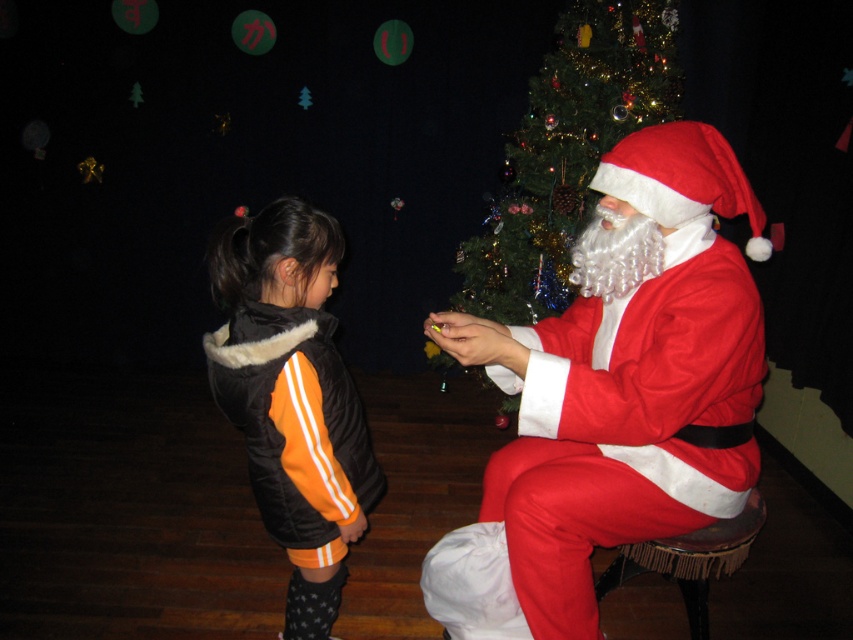
Is point (572, 184) farther from viewer compared to point (711, 548)?

Yes, it is.

You are a GUI agent. You are given a task and a screenshot of the screen. Output one action in this format:
    pyautogui.click(x=<x>, y=<y>)
    Task: Click on the green shiny christmas tree at upper center
    
    Given the screenshot: What is the action you would take?
    pyautogui.click(x=567, y=152)

Does velvet red santa at right have a larger size compared to velvet-like brown stool at lower right?

Yes.

Can you confirm if velvet red santa at right is shorter than velvet-like brown stool at lower right?

Incorrect, velvet red santa at right's height does not fall short of velvet-like brown stool at lower right's.

Is point (485, 497) closer to viewer compared to point (711, 573)?

That is True.

At what (x,y) coordinates should I click in order to perform the action: click on velvet red santa at right. Please return your answer as a coordinate pair (x, y). This screenshot has height=640, width=853. Looking at the image, I should click on (625, 376).

Is black fleece jacket at left wider than velvet-like brown stool at lower right?

Incorrect, black fleece jacket at left's width does not surpass velvet-like brown stool at lower right's.

Is point (357, 461) positioned before point (706, 536)?

Yes, it is in front of point (706, 536).

Which is in front, point (322, 499) or point (695, 627)?

Point (322, 499) is more forward.

Where is `black fleece jacket at left`? Image resolution: width=853 pixels, height=640 pixels. black fleece jacket at left is located at coordinates (292, 397).